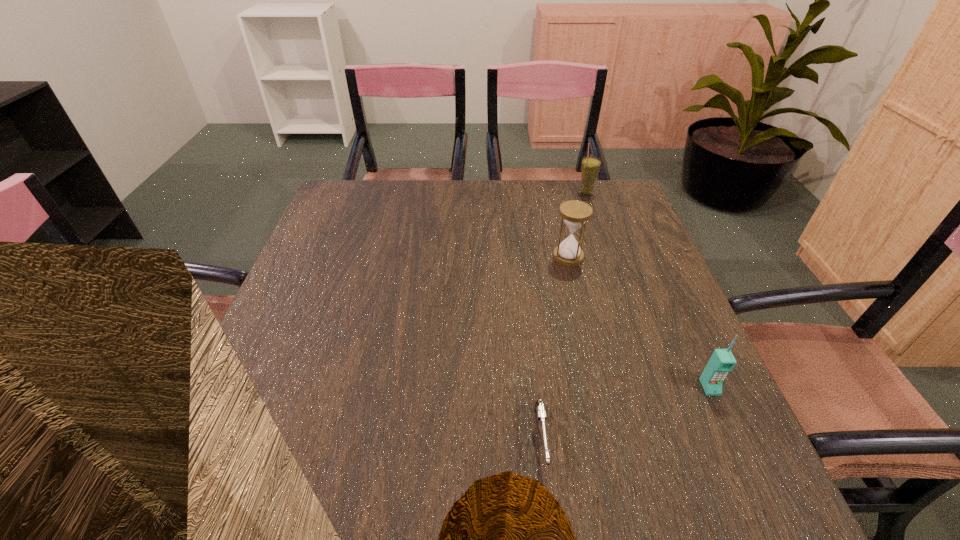
Where is `the tallest object`? This screenshot has height=540, width=960. the tallest object is located at coordinates (590, 166).

Locate an element on the screen. The height and width of the screenshot is (540, 960). straw for drinking is located at coordinates (590, 166).

The height and width of the screenshot is (540, 960). In order to click on the third object from right to left in this screenshot , I will do `click(574, 213)`.

Where is `hourglass`? Image resolution: width=960 pixels, height=540 pixels. hourglass is located at coordinates (574, 213).

Where is `cellular telephone`? The height and width of the screenshot is (540, 960). cellular telephone is located at coordinates (722, 361).

This screenshot has height=540, width=960. I want to click on the rightmost object, so click(x=722, y=361).

Find the location of a particular element. This screenshot has height=540, width=960. pistol is located at coordinates (540, 409).

Locate an element on the screen. This screenshot has height=540, width=960. the leftmost object is located at coordinates (540, 409).

Locate an element on the screen. The width and height of the screenshot is (960, 540). vacant point located on the left of the third object from left to right is located at coordinates (513, 193).

Locate an element on the screen. This screenshot has width=960, height=540. vacant area situated on the front of the hourglass is located at coordinates (575, 285).